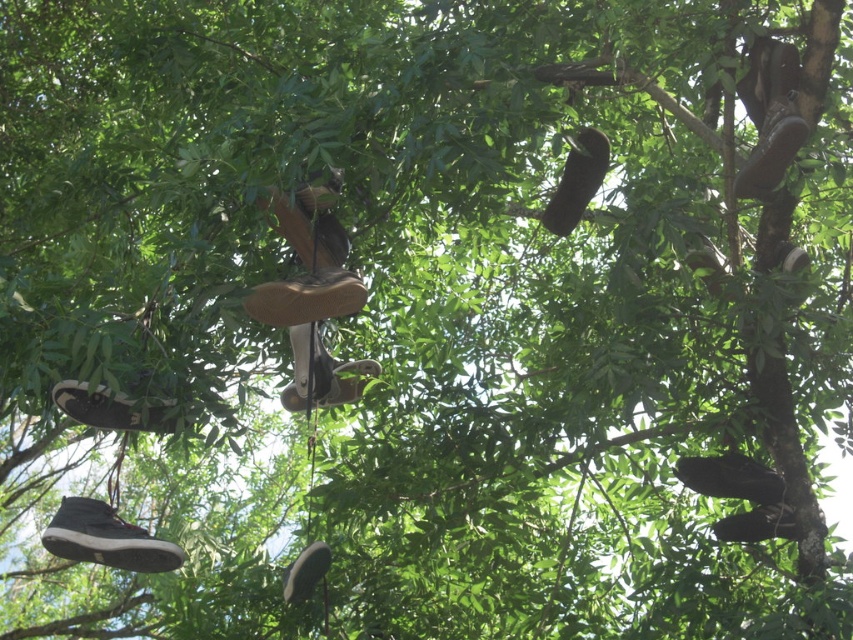
Can you confirm if brown suede shoe at upper right is shorter than matte black shoe at center?

Yes.

Who is more forward, (769, 166) or (318, 548)?

Point (769, 166)

This screenshot has width=853, height=640. Find the location of `brown suede shoe at upper right`. brown suede shoe at upper right is located at coordinates (770, 157).

Consider the image. Who is shorter, brown suede shoe at upper right or matte brown shoe at center?

matte brown shoe at center is shorter.

Is brown suede shoe at upper right wider than matte brown shoe at center?

In fact, brown suede shoe at upper right might be narrower than matte brown shoe at center.

Which is behind, point (767, 154) or point (341, 369)?

Point (341, 369)

Where is `brown suede shoe at upper right`? brown suede shoe at upper right is located at coordinates (770, 157).

Is the position of leather shoe at center more distant than that of brown suede shoe at upper right?

No, it is not.

Can you confirm if leather shoe at center is taller than brown suede shoe at upper right?

Yes.

Does point (585, 138) come behind point (772, 184)?

Yes, it is behind point (772, 184).

Find the location of a particular element. leather shoe at center is located at coordinates (577, 180).